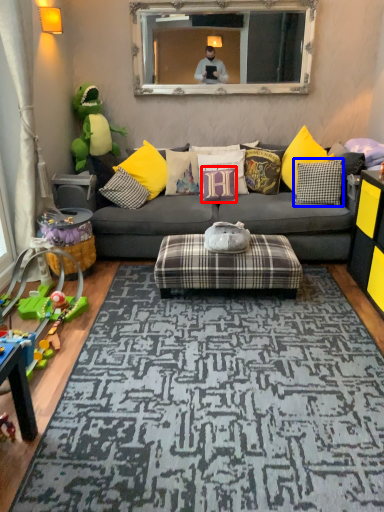
Question: Which point is closer to the camera, pillow (highlighted by a red box) or pillow (highlighted by a blue box)?

Choices:
 (A) pillow
 (B) pillow

Answer: (B)